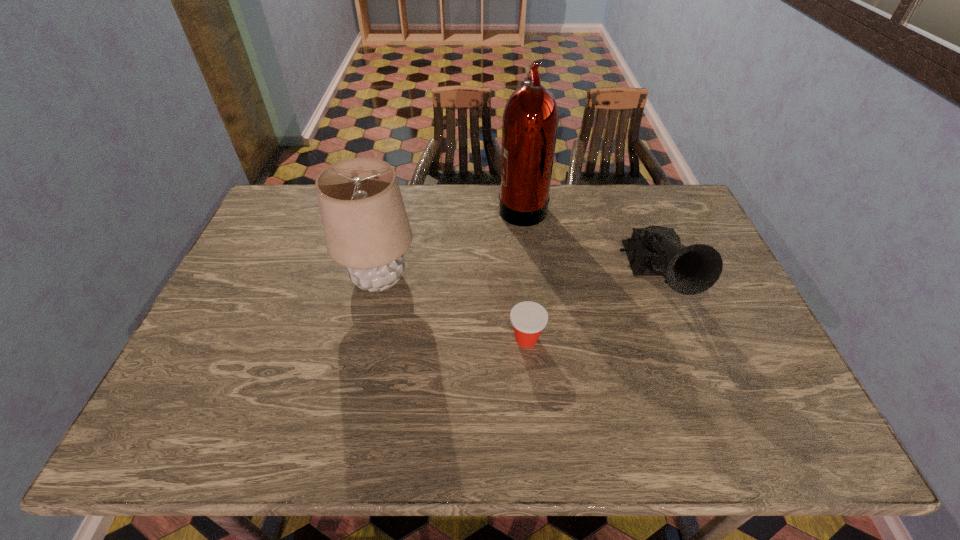
Locate an element on the screen. This screenshot has width=960, height=540. fire extinguisher is located at coordinates (530, 123).

Image resolution: width=960 pixels, height=540 pixels. I want to click on the farthest object, so click(530, 123).

I want to click on the leftmost object, so pos(366,227).

The height and width of the screenshot is (540, 960). Identify the location of the third shortest object. (366, 227).

The width and height of the screenshot is (960, 540). I want to click on the second shortest object, so click(x=655, y=250).

Find the location of `phonograph_record`. phonograph_record is located at coordinates (655, 250).

At what (x,y) coordinates should I click in order to perform the action: click on the nearest object. Please return your answer as a coordinate pair (x, y). Looking at the image, I should click on (528, 318).

Identify the location of the shortest object. (528, 318).

Identify the location of vacant space located 0.120m on the front-facing side of the farthest object. (464, 206).

Locate an element on the screen. The height and width of the screenshot is (540, 960). free space located 0.110m on the front-facing side of the farthest object is located at coordinates (467, 206).